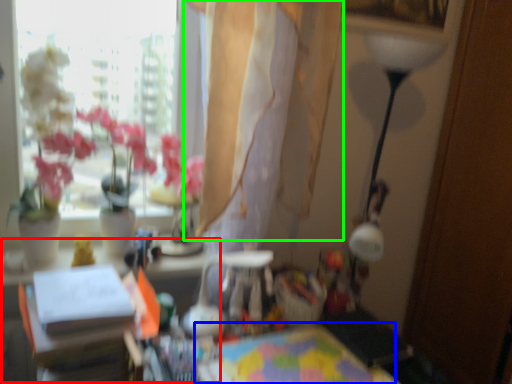
Question: Which is nearer to the table (highlighted by a red box)? table (highlighted by a blue box) or curtain (highlighted by a green box).

Choices:
 (A) table
 (B) curtain

Answer: (A)